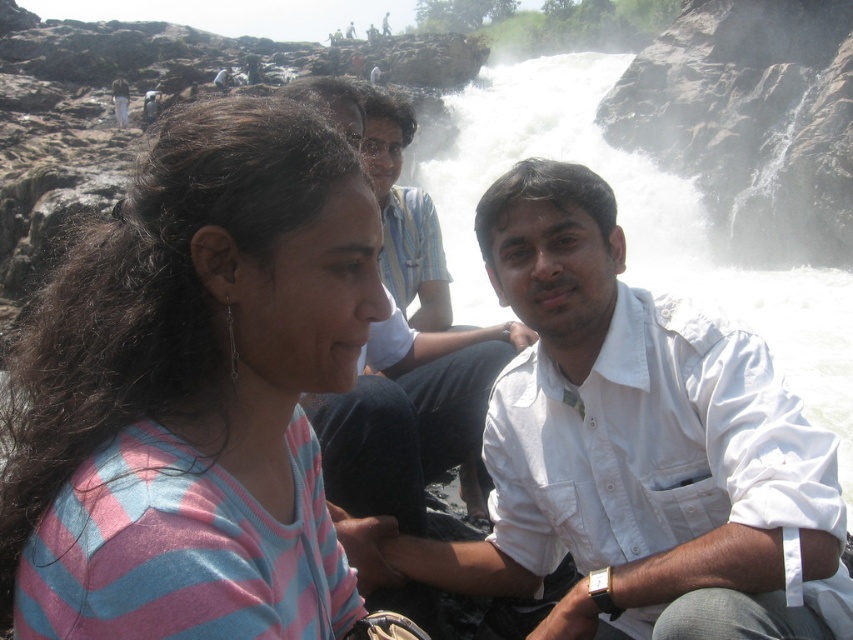
You are a photographer trying to capture a group photo of the pink striped sweater at left and the white shirt at center. Since you want to ensure both subjects are clearly visible, which subject should you focus on first to avoid blurriness if the camera has limited focus range?

The pink striped sweater at left should be focused on first because its width is smaller than the white shirt at center, making it easier to capture clearly within the limited focus range.

You are a photographer trying to capture a photo of the waterfall. You notice two white shirts in the scene. The first is labeled as white cotton shirt at center and the second as white shirt at center. Which of these two white shirts is shorter in height?

The white cotton shirt at center is shorter in height than the white shirt at center.